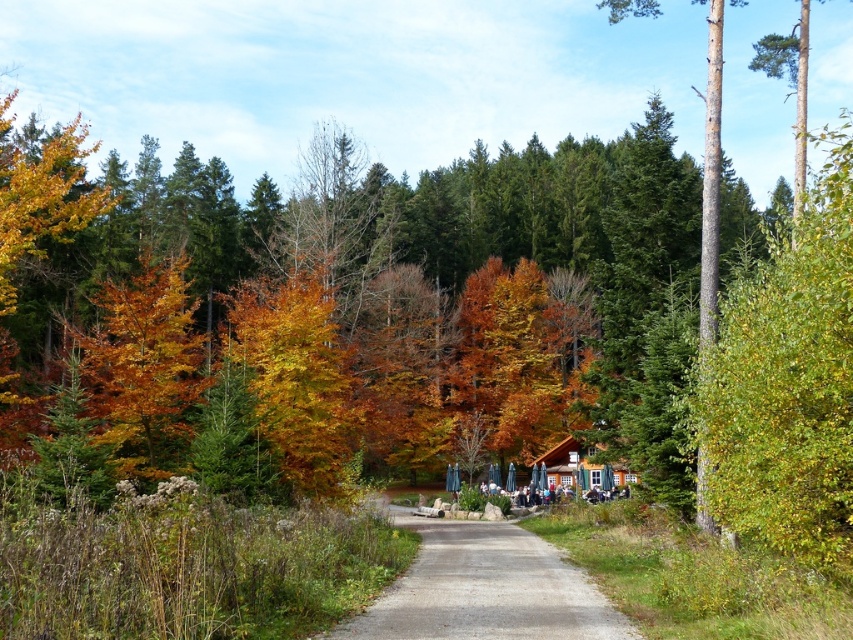
Does gray concrete path at center have a lesser width compared to wooden cabin at center?

Indeed, gray concrete path at center has a lesser width compared to wooden cabin at center.

Is point (434, 572) in front of point (567, 451)?

Yes, it is in front of point (567, 451).

Describe the element at coordinates (485, 589) in the screenshot. I see `gray concrete path at center` at that location.

Find the location of `gray concrete path at center`. gray concrete path at center is located at coordinates (485, 589).